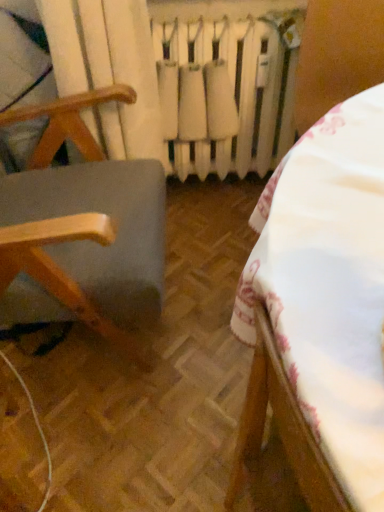
Question: Does wooden chair at left, acting as the 2th furniture starting from the right, have a lesser width compared to white fabric tablecloth at center, the second furniture viewed from the left?

Choices:
 (A) no
 (B) yes

Answer: (B)

Question: Is wooden chair at left, acting as the 2th furniture starting from the right, facing towards white fabric tablecloth at center, the second furniture viewed from the left?

Choices:
 (A) yes
 (B) no

Answer: (B)

Question: Does wooden chair at left, positioned as the first furniture in left-to-right order, have a smaller size compared to white fabric tablecloth at center, the first furniture viewed from the right?

Choices:
 (A) no
 (B) yes

Answer: (A)

Question: Does wooden chair at left, positioned as the first furniture in left-to-right order, have a lesser height compared to white fabric tablecloth at center, the first furniture viewed from the right?

Choices:
 (A) no
 (B) yes

Answer: (A)

Question: Is the depth of wooden chair at left, positioned as the first furniture in left-to-right order, greater than that of white fabric tablecloth at center, the second furniture viewed from the left?

Choices:
 (A) no
 (B) yes

Answer: (B)

Question: Considering the positions of point (266, 159) and point (336, 176), is point (266, 159) closer or farther from the camera than point (336, 176)?

Choices:
 (A) farther
 (B) closer

Answer: (A)

Question: Looking at the image, does white matte radiator at center seem bigger or smaller compared to white fabric tablecloth at center, the first furniture viewed from the right?

Choices:
 (A) small
 (B) big

Answer: (A)

Question: From their relative heights in the image, would you say white matte radiator at center is taller or shorter than white fabric tablecloth at center, the second furniture viewed from the left?

Choices:
 (A) short
 (B) tall

Answer: (A)

Question: In terms of width, does white matte radiator at center look wider or thinner when compared to white fabric tablecloth at center, the first furniture viewed from the right?

Choices:
 (A) wide
 (B) thin

Answer: (B)

Question: Is white fabric tablecloth at center, the first furniture viewed from the right, inside or outside of white matte radiator at center?

Choices:
 (A) outside
 (B) inside

Answer: (A)

Question: Is point (375, 168) closer or farther from the camera than point (246, 31)?

Choices:
 (A) closer
 (B) farther

Answer: (A)

Question: Relative to white matte radiator at center, is white fabric tablecloth at center, the first furniture viewed from the right, in front or behind?

Choices:
 (A) behind
 (B) front

Answer: (B)

Question: From a real-world perspective, is white fabric tablecloth at center, the second furniture viewed from the left, positioned above or below white matte radiator at center?

Choices:
 (A) below
 (B) above

Answer: (B)

Question: Relative to wooden chair at left, positioned as the first furniture in left-to-right order, is white fabric tablecloth at center, the second furniture viewed from the left, in front or behind?

Choices:
 (A) front
 (B) behind

Answer: (A)

Question: Is white fabric tablecloth at center, the second furniture viewed from the left, wider or thinner than wooden chair at left, positioned as the first furniture in left-to-right order?

Choices:
 (A) wide
 (B) thin

Answer: (A)